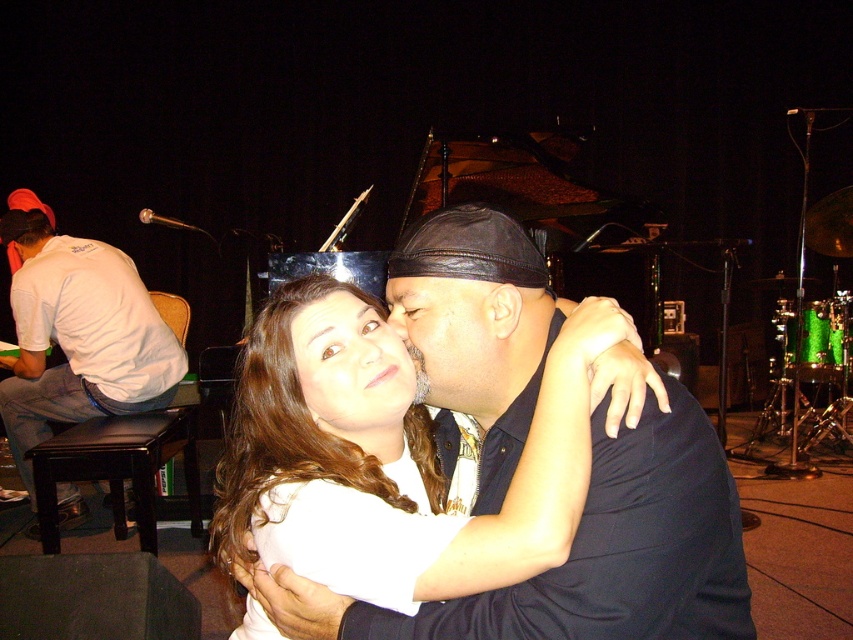
Is matte white face at center to the left of matte black hat at center from the viewer's perspective?

Correct, you'll find matte white face at center to the left of matte black hat at center.

You are a GUI agent. You are given a task and a screenshot of the screen. Output one action in this format:
    pyautogui.click(x=<x>, y=<y>)
    Task: Click on the matte white face at center
    The height and width of the screenshot is (640, 853).
    Given the screenshot: What is the action you would take?
    pyautogui.click(x=351, y=365)

The height and width of the screenshot is (640, 853). I want to click on matte white face at center, so click(x=351, y=365).

Is dark brown leather stool at lower left wider than matte black hat at center?

Yes, dark brown leather stool at lower left is wider than matte black hat at center.

Is point (120, 460) closer to camera compared to point (462, 316)?

No, it is behind (462, 316).

Describe the element at coordinates (119, 467) in the screenshot. The height and width of the screenshot is (640, 853). I see `dark brown leather stool at lower left` at that location.

Locate an element on the screen. The image size is (853, 640). dark brown leather stool at lower left is located at coordinates (119, 467).

Is dark blue shirt at center below dark brown leather stool at lower left?

No, dark blue shirt at center is not below dark brown leather stool at lower left.

Does dark blue shirt at center have a smaller size compared to dark brown leather stool at lower left?

Indeed, dark blue shirt at center has a smaller size compared to dark brown leather stool at lower left.

Locate an element on the screen. The image size is (853, 640). dark blue shirt at center is located at coordinates (593, 556).